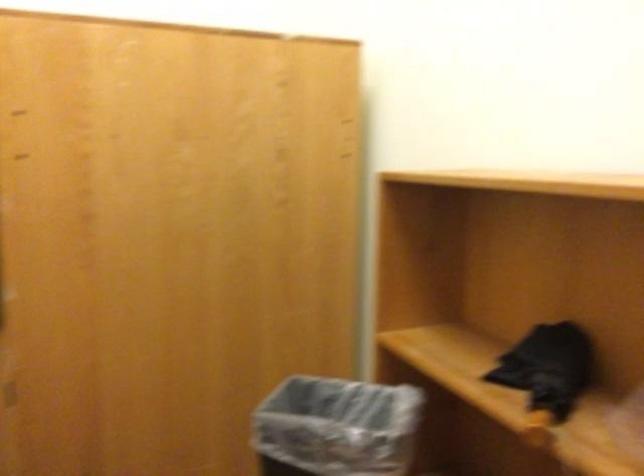
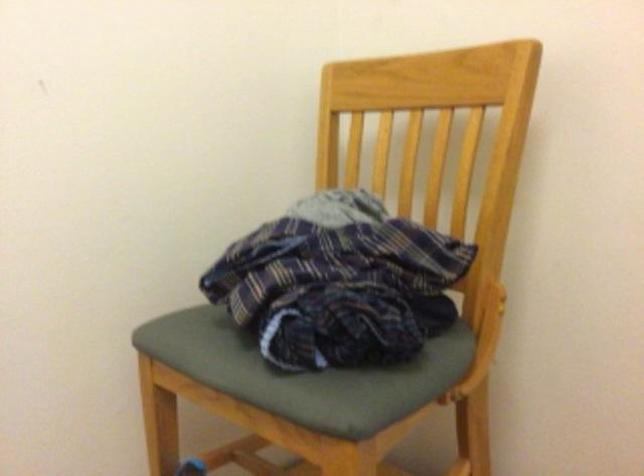
Question: Based on the continuous images, in which direction is the camera rotating? Reply with the corresponding letter.

Choices:
 (A) Left
 (B) Right
 (C) Up
 (D) Down

Answer: (B)